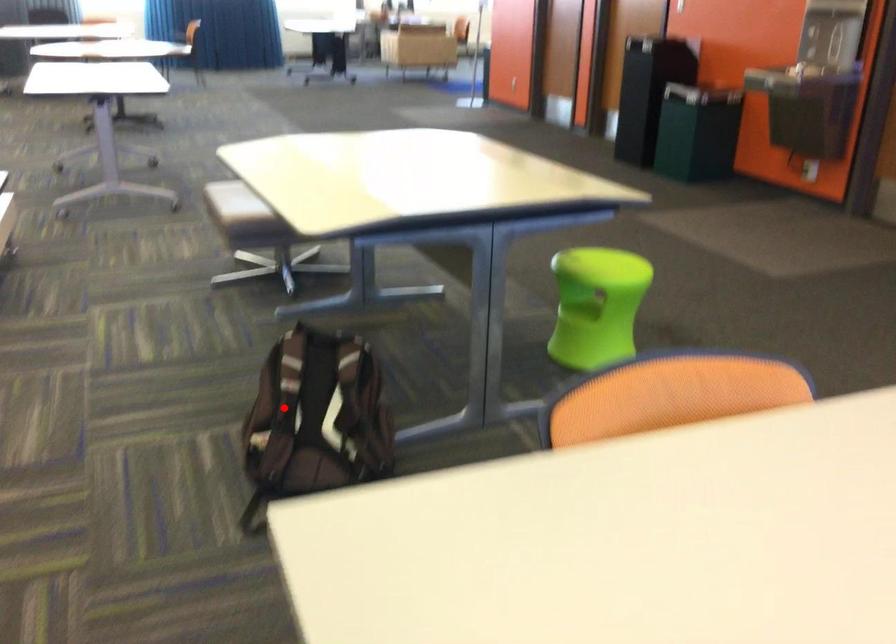
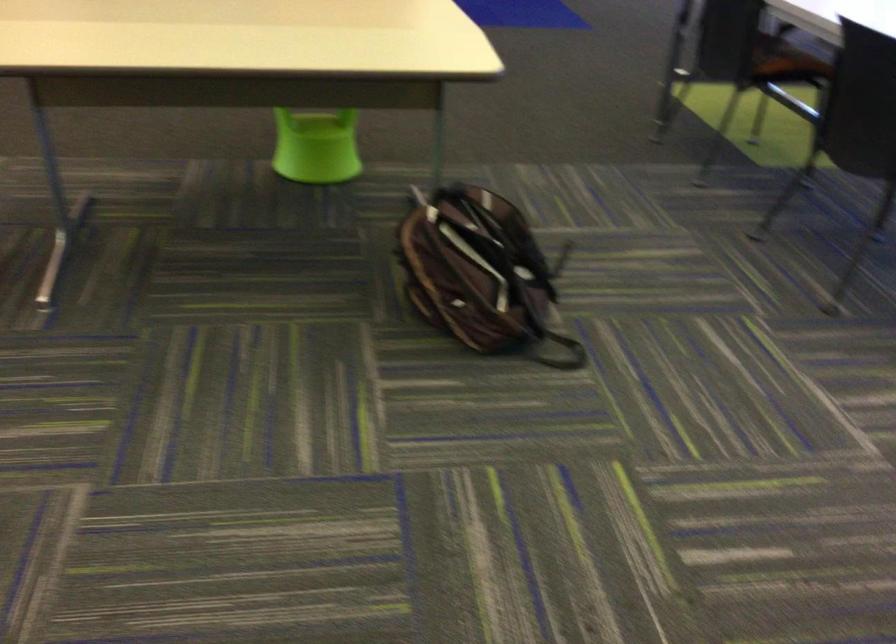
Where in the second image is the point corresponding to the highlighted location from the first image?

(479, 272)